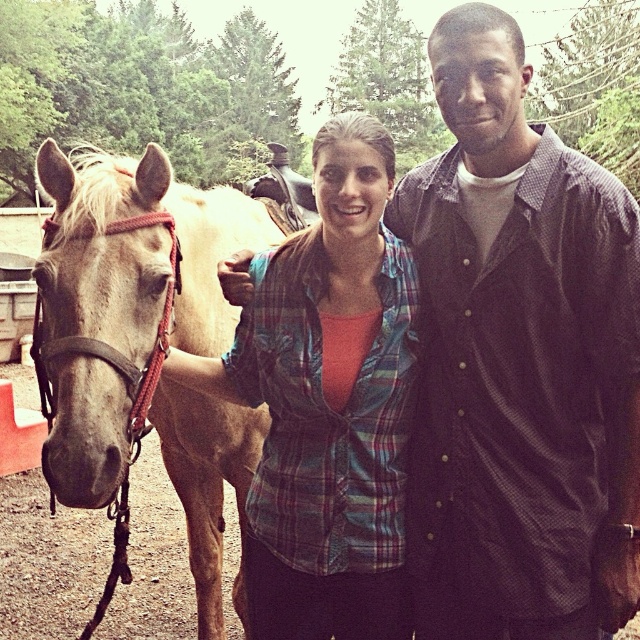
You are taking a photo of the plaid shirt at center and the light brown horse at left. Which object is closer to the camera?

The plaid shirt at center is closer to the camera than the light brown horse at left.